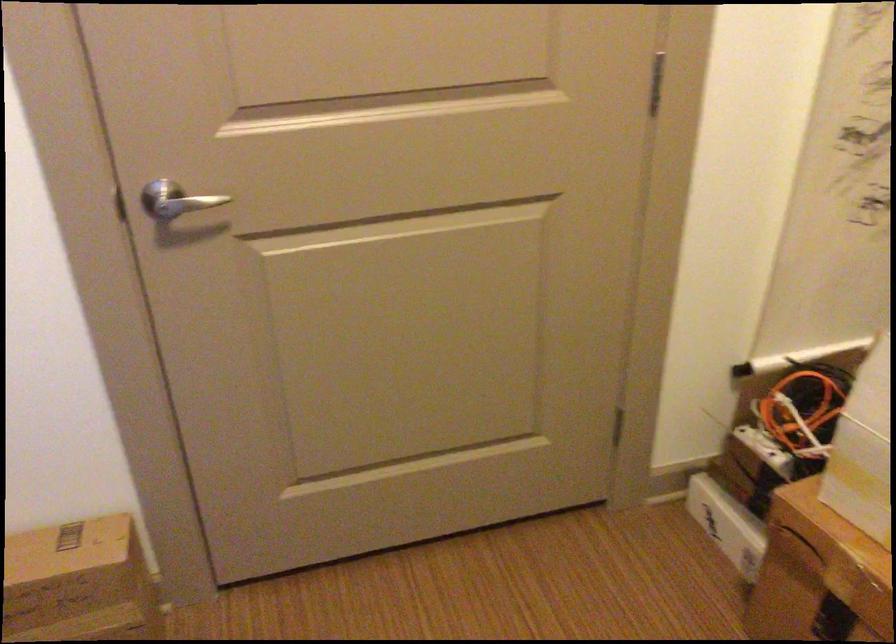
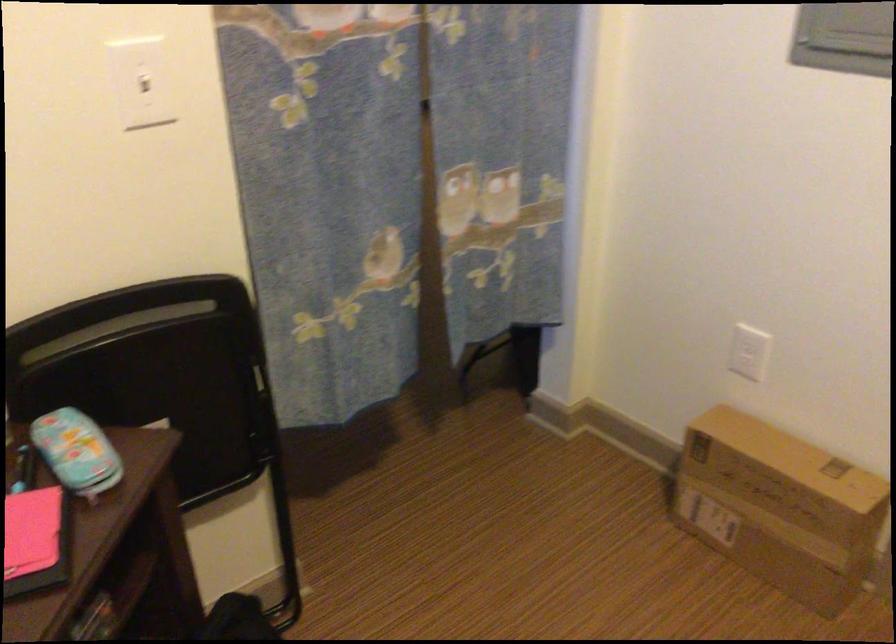
First-person continuous shooting, in which direction is the camera rotating?

The rotation direction of the camera is left-down.